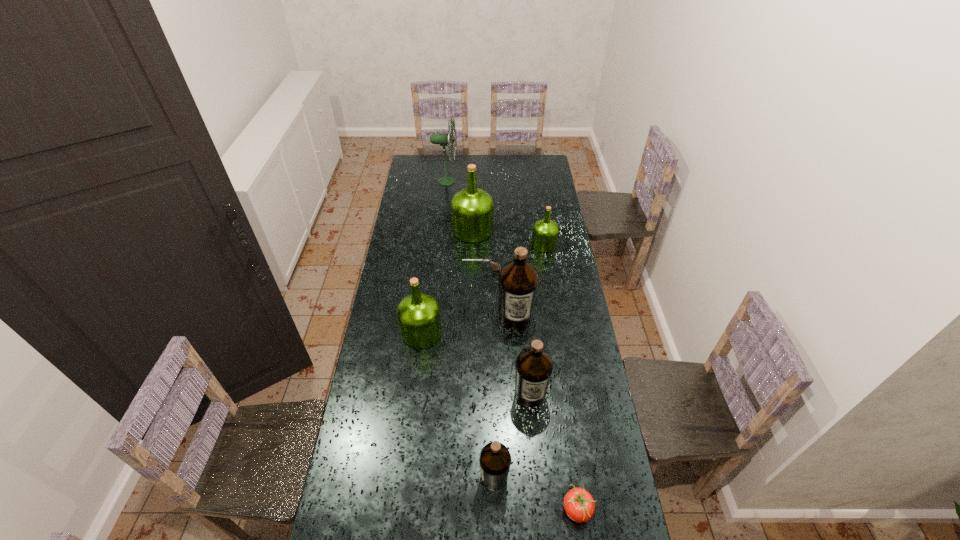
Where is `vacant region located on the label of the second nearest olive oil`? This screenshot has width=960, height=540. vacant region located on the label of the second nearest olive oil is located at coordinates (533, 428).

Locate an element on the screen. The height and width of the screenshot is (540, 960). free space located on the back of the rightmost green olive oil is located at coordinates (538, 201).

The image size is (960, 540). I want to click on vacant space located 0.260m on the label of the smallest brown olive oil, so click(x=397, y=477).

The image size is (960, 540). In order to click on vacant space situated on the label of the smallest brown olive oil in this screenshot , I will do `click(460, 477)`.

Where is `vacant space located 0.150m on the label of the smallest brown olive oil`? Image resolution: width=960 pixels, height=540 pixels. vacant space located 0.150m on the label of the smallest brown olive oil is located at coordinates (432, 477).

Locate an element on the screen. vacant space located on the back of the red tomato is located at coordinates (561, 397).

You are a GUI agent. You are given a task and a screenshot of the screen. Output one action in this format:
    pyautogui.click(x=<x>, y=<y>)
    Task: Click on the vacant area situated 0.280m aiming along the barrel of the shortest object
    
    Given the screenshot: What is the action you would take?
    402,271

The height and width of the screenshot is (540, 960). I want to click on blank area located aiming along the barrel of the shortest object, so click(x=444, y=271).

Where is `free point located 0.220m aiming along the barrel of the shortest object`? free point located 0.220m aiming along the barrel of the shortest object is located at coordinates (416, 271).

Image resolution: width=960 pixels, height=540 pixels. I want to click on object situated at the far edge, so click(x=442, y=139).